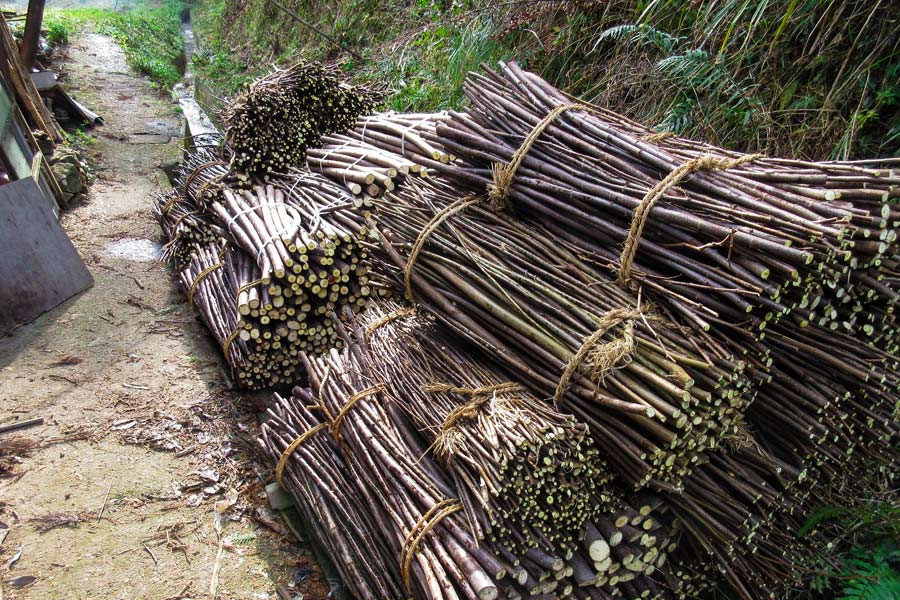
The height and width of the screenshot is (600, 900). Find the location of `wood beams`. wood beams is located at coordinates (31, 114), (36, 97), (32, 46).